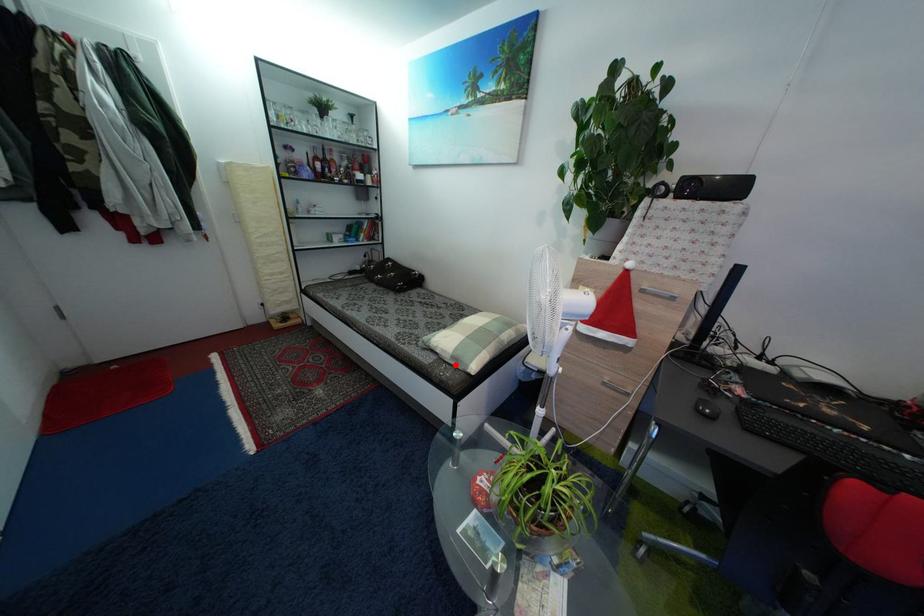
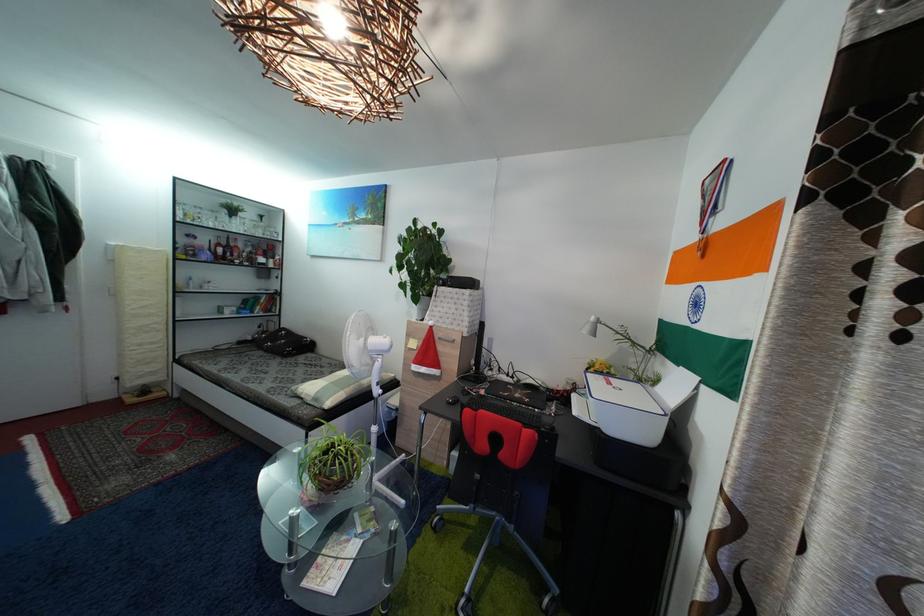
Question: I am providing you with two images of the same scene from different viewpoints. Given a red point in image1, look at the same physical point in image2. Is it:

Choices:
 (A) Closer to the viewpoint
 (B) Farther from the viewpoint

Answer: (B)